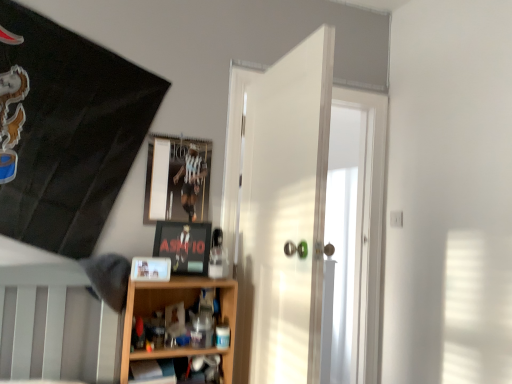
Question: Is point (231, 337) positioned closer to the camera than point (165, 185)?

Choices:
 (A) farther
 (B) closer

Answer: (B)

Question: Is wooden shelf at lower center, the 2th shelf when ordered from bottom to top, taller or shorter than metallic reflective frame at upper center, marked as the 3th picture frame in a bottom-to-top arrangement?

Choices:
 (A) short
 (B) tall

Answer: (B)

Question: Which of these objects is positioned farthest from the wooden shelf at lower center, which is counted as the second shelf, starting from the top?

Choices:
 (A) white glossy door at center
 (B) matte black picture frame at center, which is the 2th picture frame in front-to-back order
 (C) metallic reflective frame at upper center, positioned as the third picture frame in front-to-back order
 (D) matte plastic picture frame at center, which is the 1th picture frame from front to back
 (E) wooden shelf at lower center, the 2th shelf when ordered from bottom to top

Answer: (C)

Question: Which is nearer to the matte plastic picture frame at center, placed as the 3th picture frame when sorted from back to front?

Choices:
 (A) wooden shelf at lower center, which ranks as the first shelf in top-to-bottom order
 (B) metallic reflective frame at upper center, which is the first picture frame from back to front
 (C) white glossy door at center
 (D) wooden shelf at lower center, which is counted as the second shelf, starting from the top
 (E) matte black picture frame at center, which ranks as the 2th picture frame in top-to-bottom order

Answer: (E)